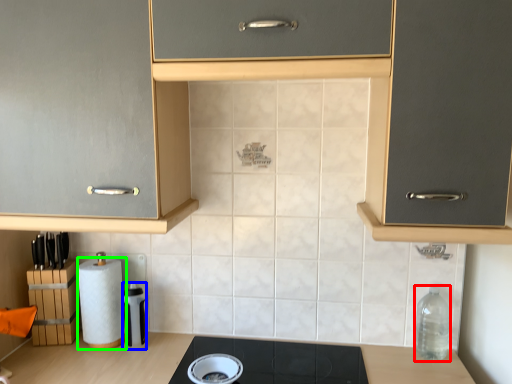
Question: Based on their relative distances, which object is nearer to bottle (highlighted by a red box)? Choose from appliance (highlighted by a blue box) and paper towel (highlighted by a green box).

Choices:
 (A) appliance
 (B) paper towel

Answer: (A)